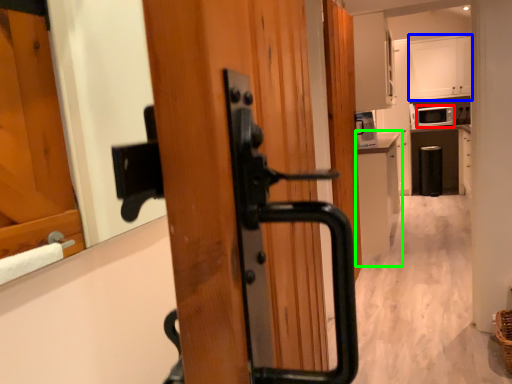
Question: Based on their relative distances, which object is farther from appliance (highlighted by a red box)? Choose from cabinetry (highlighted by a blue box) and cabinetry (highlighted by a green box).

Choices:
 (A) cabinetry
 (B) cabinetry

Answer: (B)